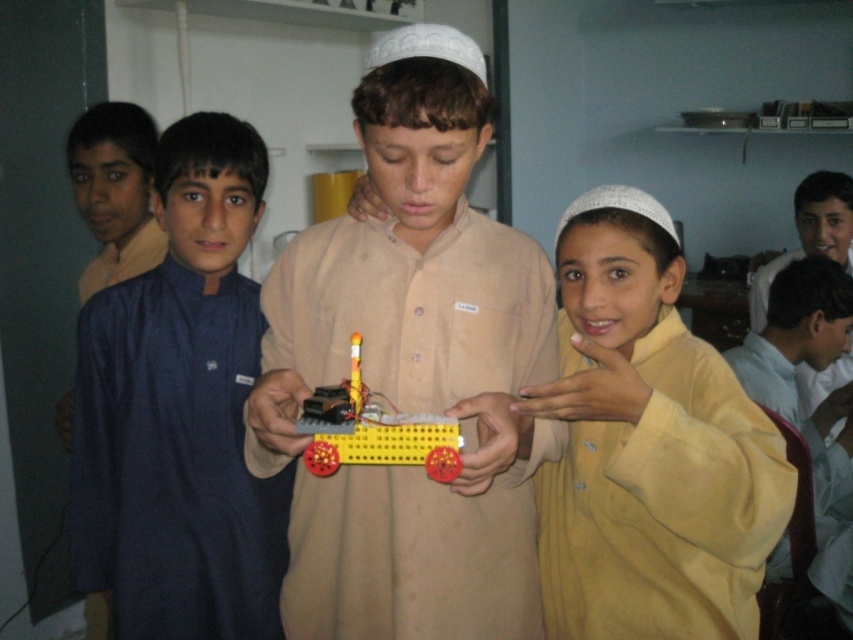
Question: Which point is farther from the camera taking this photo?

Choices:
 (A) (334, 385)
 (B) (755, 465)
 (C) (125, 374)
 (D) (784, 417)

Answer: (D)

Question: Which object is the closest to the yellow matte shirt at lower right?

Choices:
 (A) light blue shirt at upper right
 (B) dark blue fabric at left
 (C) yellow matte/yellowish-knit sweater at center
 (D) beige matte shirt at center

Answer: (A)

Question: Is yellow matte/yellowish-knit sweater at center to the left of yellow matte shirt at lower right from the viewer's perspective?

Choices:
 (A) yes
 (B) no

Answer: (A)

Question: Which is nearer to the yellow matte shirt at lower right?

Choices:
 (A) beige matte shirt at center
 (B) yellow plastic toy at center
 (C) dark blue fabric at left

Answer: (A)

Question: Can you confirm if yellow matte/yellowish-knit sweater at center is positioned to the left of yellow plastic toy at center?

Choices:
 (A) no
 (B) yes

Answer: (A)

Question: Observing the image, what is the correct spatial positioning of beige matte shirt at center in reference to yellow plastic toy at center?

Choices:
 (A) above
 (B) below

Answer: (A)